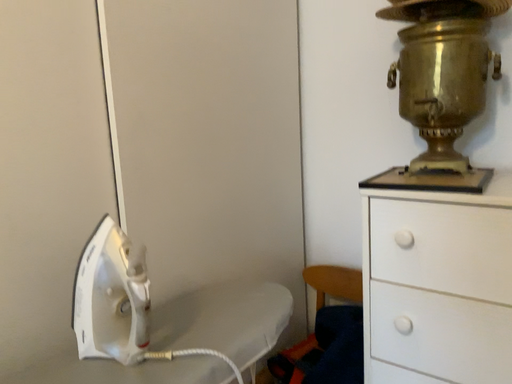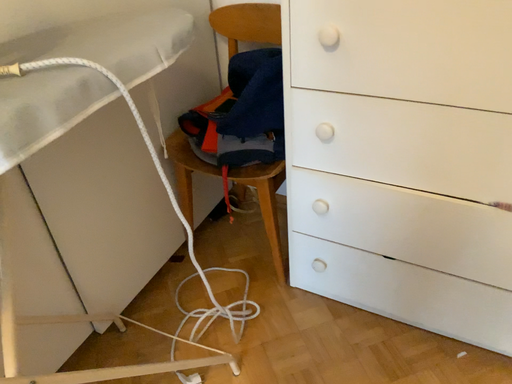
Question: How did the camera likely rotate when shooting the video?

Choices:
 (A) rotated downward
 (B) rotated upward

Answer: (A)